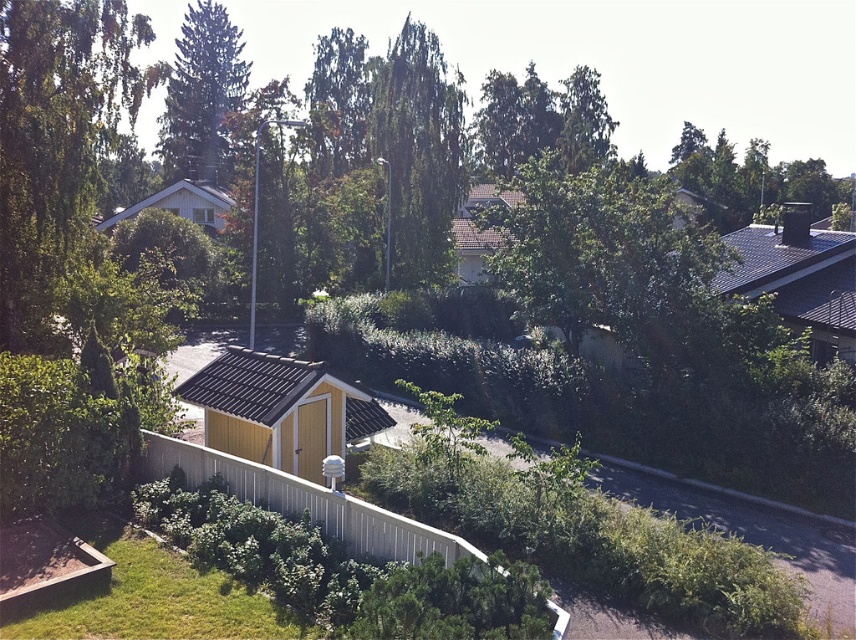
Question: Can you confirm if green leafy tree at upper left is positioned below green leafy tree at center?

Choices:
 (A) yes
 (B) no

Answer: (A)

Question: Based on their relative distances, which object is nearer to the green leafy tree at upper left?

Choices:
 (A) green leafy tree at upper center
 (B) green leafy tree at center

Answer: (B)

Question: Considering the relative positions of green leafy tree at center and green leafy tree at upper center in the image provided, where is green leafy tree at center located with respect to green leafy tree at upper center?

Choices:
 (A) left
 (B) right

Answer: (B)

Question: Based on their relative distances, which object is farther from the green leafy tree at center?

Choices:
 (A) green leafy tree at upper center
 (B) green leafy tree at upper left

Answer: (A)

Question: Among these objects, which one is nearest to the camera?

Choices:
 (A) green leafy tree at upper left
 (B) green leafy tree at upper center
 (C) green leafy tree at center

Answer: (A)

Question: Can you confirm if green leafy tree at upper left is smaller than green leafy tree at center?

Choices:
 (A) yes
 (B) no

Answer: (B)